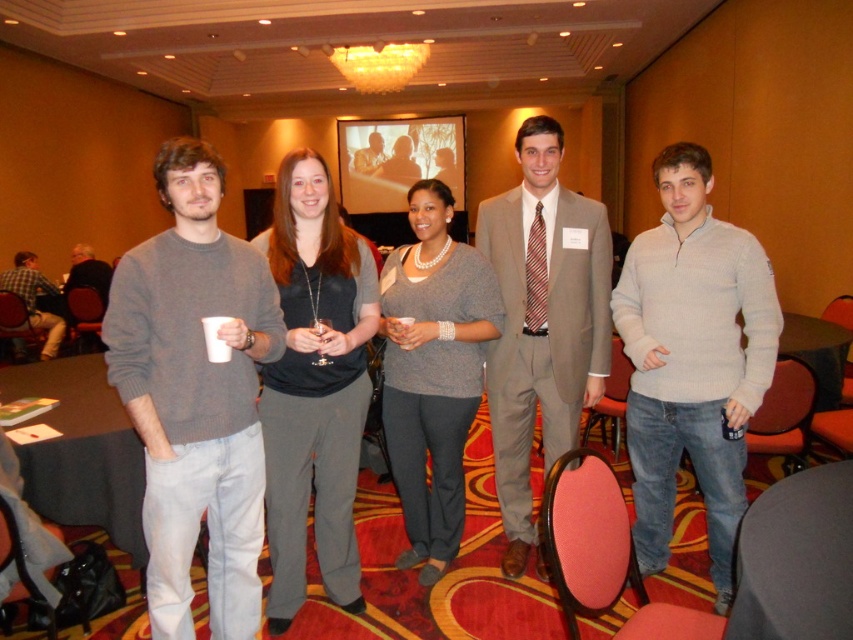
Question: Does matte gray sweater at center appear under plaid cotton shirt at left?

Choices:
 (A) no
 (B) yes

Answer: (B)

Question: From the image, what is the correct spatial relationship of light gray sweater at center in relation to plaid cotton shirt at left?

Choices:
 (A) left
 (B) right

Answer: (B)

Question: Which of these objects is positioned closest to the dark gray sweater at left?

Choices:
 (A) matte gray suit at center
 (B) gray sweater at center
 (C) light gray sweater at center
 (D) plaid cotton shirt at left

Answer: (D)

Question: Does matte gray suit at center appear on the right side of dark gray fabric table at lower left?

Choices:
 (A) yes
 (B) no

Answer: (A)

Question: Which object is farther from the camera taking this photo?

Choices:
 (A) matte gray sweater at center
 (B) matte gray suit at center

Answer: (B)

Question: Which object is closer to the camera taking this photo?

Choices:
 (A) dark gray sweater at left
 (B) light gray sweater at center
 (C) matte gray sweater at center

Answer: (C)